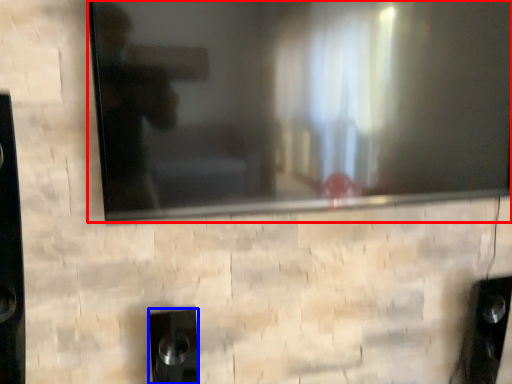
Question: Which object appears closest to the camera in this image, television (highlighted by a red box) or speaker (highlighted by a blue box)?

Choices:
 (A) television
 (B) speaker

Answer: (A)